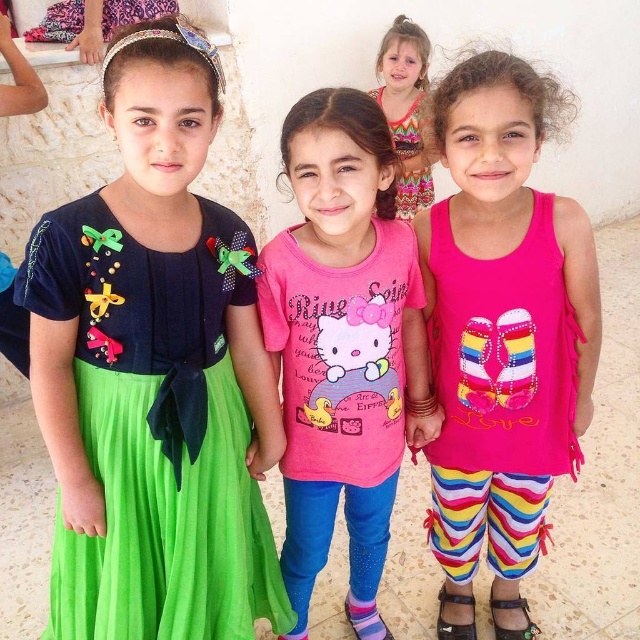
You are a photographer trying to capture a group photo of the three girls. You need to ensure that the green fabric dress at left and the pink fabric tank top at center are both clearly visible. Given their sizes, which clothing item might require you to adjust your camera angle to avoid being overshadowed?

The green fabric dress at left has a smaller size compared to the pink fabric tank top at center, so the green fabric dress at left might require adjusting the camera angle to avoid being overshadowed by the larger pink fabric tank top at center.

In the scene shown: You are a photographer setting up for a group photo. You want to ensure that the green fabric dress at left and the pink fabric tank top at center are both clearly visible in the frame. Given that your camera has a minimum focus distance of 25 inches, will you be able to capture both subjects at this distance?

The green fabric dress at left is 25.53 inches away from the pink fabric tank top at center. Since the minimum focus distance is 25 inches, the camera can focus on both subjects as the distance between them is slightly more than the required minimum distance.

You are a photographer trying to capture a photo of the green fabric dress at left and the brown leather sandal at lower right. Can you fit both into the frame of your camera, which has a maximum width of 3 feet?

The green fabric dress at left and brown leather sandal at lower right are 3.65 feet apart from each other. Since the distance between them exceeds the camera frame width of 3 feet, you cannot fit both into the frame.